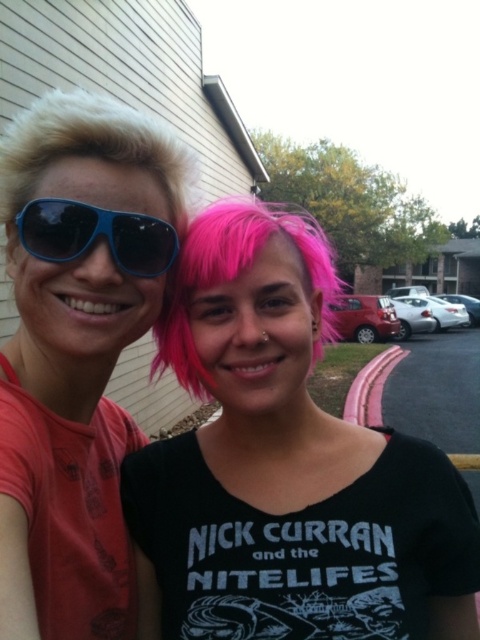
How distant is pink matte wig at center from blondehair at left?

pink matte wig at center is 14.93 inches away from blondehair at left.

Is pink matte wig at center taller than blondehair at left?

Yes.

What do you see at coordinates (286, 467) in the screenshot? The height and width of the screenshot is (640, 480). I see `pink matte wig at center` at bounding box center [286, 467].

Locate an element on the screen. The height and width of the screenshot is (640, 480). pink matte wig at center is located at coordinates (286, 467).

Between pink matte hair at center and blondehair at left, which one is positioned higher?

pink matte hair at center

Does pink matte hair at center have a lesser width compared to blondehair at left?

No, pink matte hair at center is not thinner than blondehair at left.

Where is `pink matte hair at center`? This screenshot has height=640, width=480. pink matte hair at center is located at coordinates point(237,276).

Does pink matte hair at center have a lesser width compared to blue matte sunglasses at left?

In fact, pink matte hair at center might be wider than blue matte sunglasses at left.

Can you confirm if pink matte hair at center is positioned above blue matte sunglasses at left?

Indeed, pink matte hair at center is positioned over blue matte sunglasses at left.

Between point (229, 259) and point (52, 260), which one is positioned behind?

Point (229, 259)

Locate an element on the screen. The height and width of the screenshot is (640, 480). pink matte hair at center is located at coordinates (237, 276).